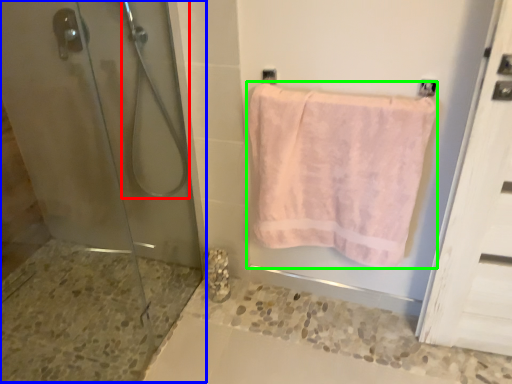
Question: Estimate the real-world distances between objects in this image. Which object is farther from shower (highlighted by a red box), shower door (highlighted by a blue box) or towel (highlighted by a green box)?

Choices:
 (A) shower door
 (B) towel

Answer: (B)